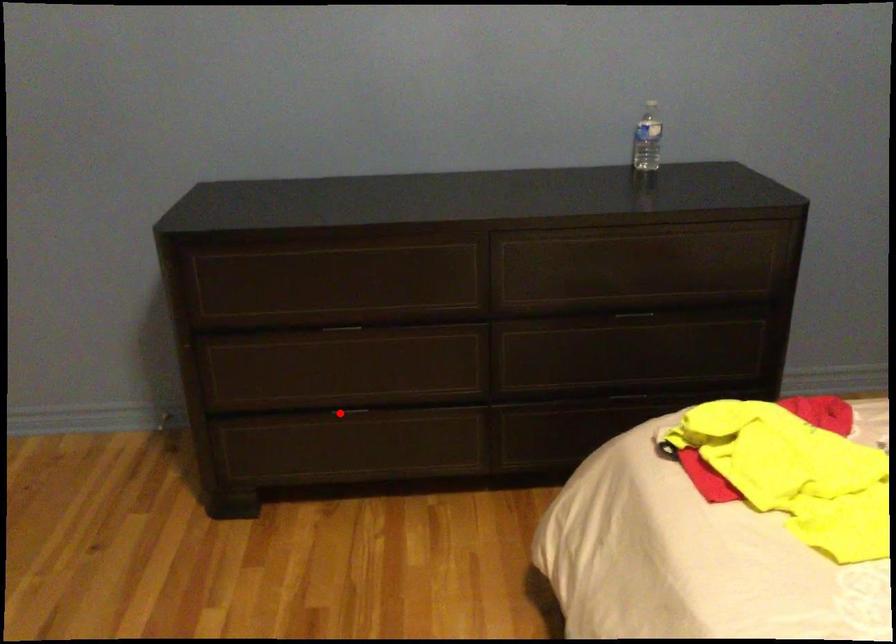
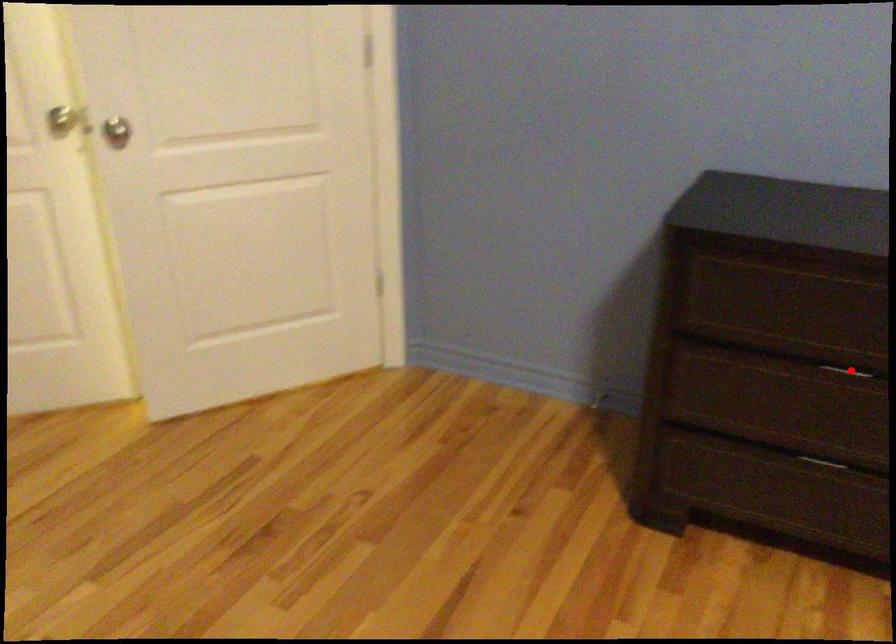
I am providing you with two images of the same scene from different viewpoints. A red point is marked on the first image and another point is marked on the second image. Is the marked point in image1 the same physical position as the marked point in image2?

No